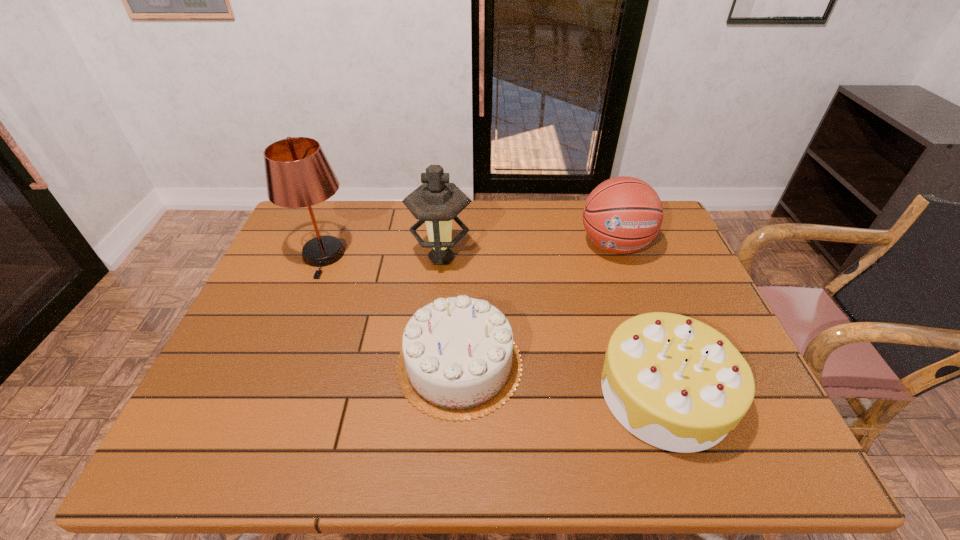
This screenshot has height=540, width=960. Find the location of `object that is the closest to the left birthday cake`. object that is the closest to the left birthday cake is located at coordinates (436, 202).

Image resolution: width=960 pixels, height=540 pixels. What are the coordinates of `object that stands as the second closest to the left birthday cake` in the screenshot? It's located at (676, 383).

Locate an element on the screen. vacant region that satisfies the following two spatial constraints: 1. on the front-facing side of the tallest object; 2. on the left side of the left birthday cake is located at coordinates (279, 364).

The width and height of the screenshot is (960, 540). What are the coordinates of `free space in the image that satisfies the following two spatial constraints: 1. on the front-facing side of the lampshade; 2. on the left side of the left birthday cake` in the screenshot? It's located at (279, 364).

At what (x,y) coordinates should I click in order to perform the action: click on free location that satisfies the following two spatial constraints: 1. on the front-facing side of the left birthday cake; 2. on the left side of the leftmost object. Please return your answer as a coordinate pair (x, y). Looking at the image, I should click on (279, 364).

At what (x,y) coordinates should I click in order to perform the action: click on vacant space that satisfies the following two spatial constraints: 1. on the front-facing side of the leftmost object; 2. on the right side of the left birthday cake. Please return your answer as a coordinate pair (x, y). This screenshot has width=960, height=540. Looking at the image, I should click on (279, 364).

Find the location of a particular element. vacant space that satisfies the following two spatial constraints: 1. on the front-facing side of the tallest object; 2. on the left side of the right birthday cake is located at coordinates (268, 393).